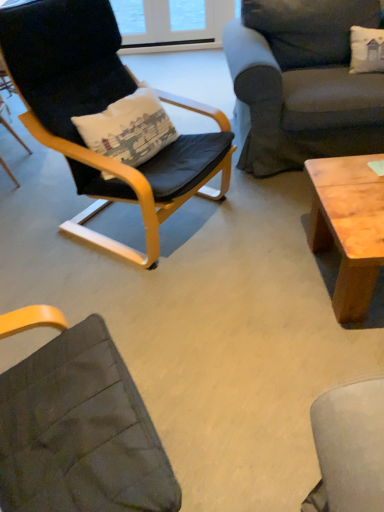
Identify the location of free space underneath matte black chair at left, placed as the second chair when sorted from right to left (from a real-world perspective). (19, 175).